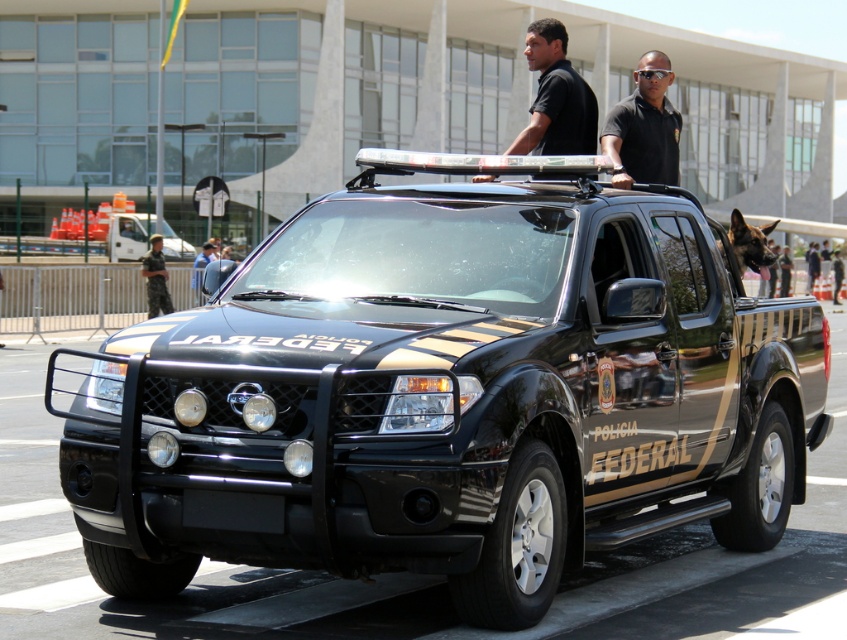
You are a photographer trying to capture a clear photo of the black uniformed man at center and the black matte truck at center. Since you want to focus on the man, you need to adjust your camera settings to ensure the truck doesn t block him. Which object should you position closer to the camera to achieve this focus?

The black matte truck at center is taller than the black uniformed man at center. To focus on the man without the truck blocking him, position the black uniformed man at center closer to the camera so that the truck appears smaller in comparison, allowing the man to be clearly visible.

Based on the scene description, which object has a greater width between the black smooth shirt at upper center and the black uniformed man at center?

The black smooth shirt at upper center has a greater width than the black uniformed man at center according to the description.

You are a photographer positioned at a safe distance from the black matte truck at center. Your camera has a focal length of 50mm. To capture the truck in a portrait orientation without any distortion, what is the minimum distance you need to be from the truck to ensure the shot fits within the frame?

The black matte truck at center is 19.27 feet from camera. To capture it in portrait orientation without distortion, the photographer should maintain at least 19.27 feet distance, as the truck is already positioned at that optimal range for a 50mm lens.